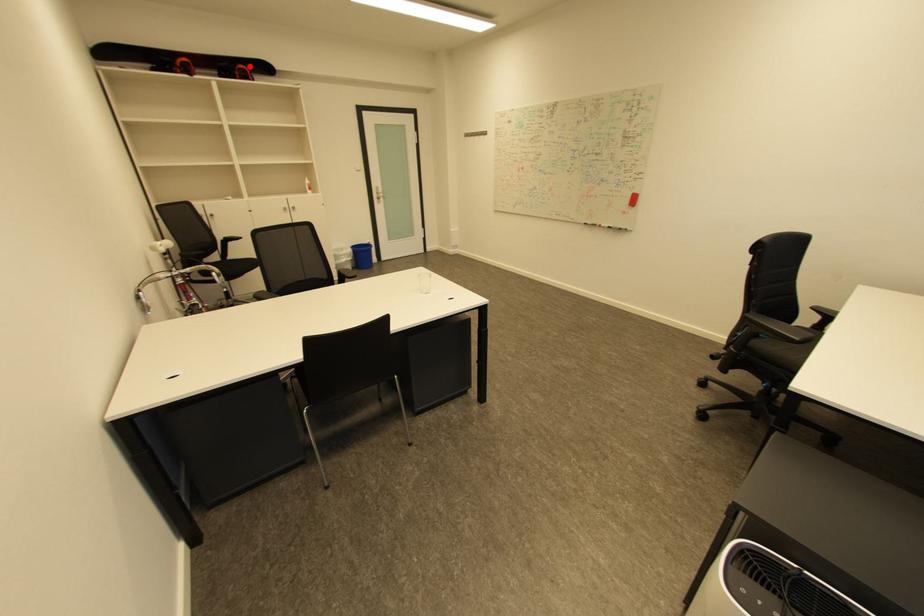
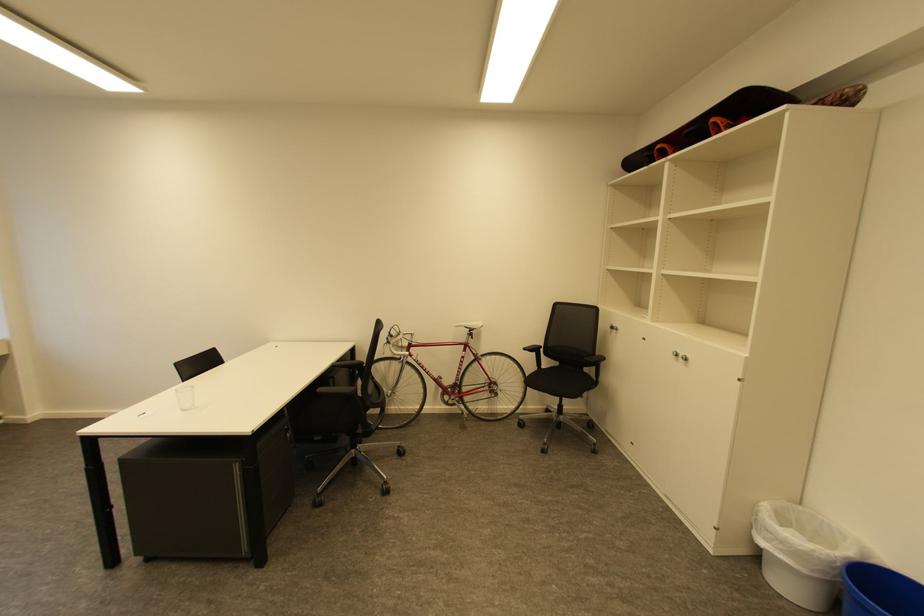
Find the pixel in the second image that matches the highlighted location in the first image.

(719, 120)